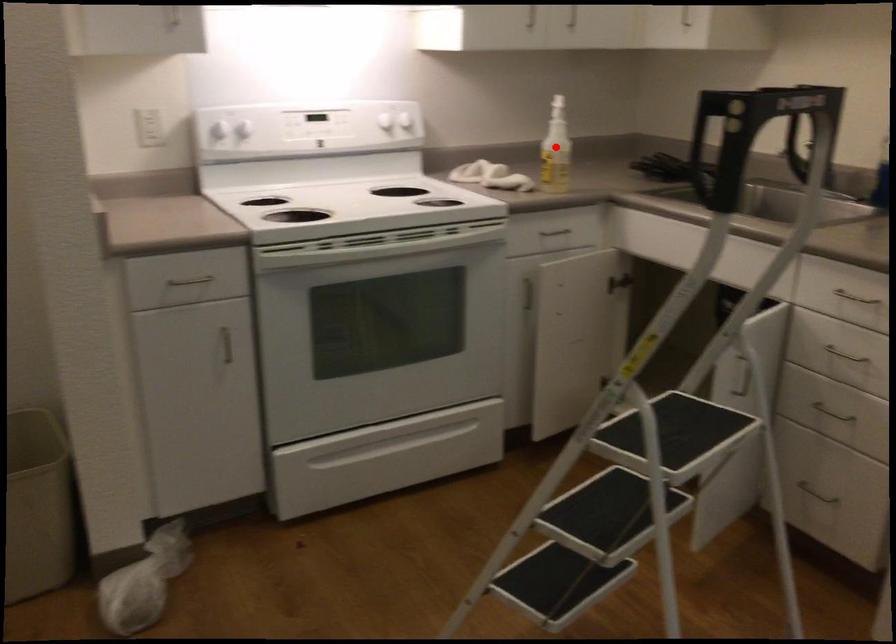
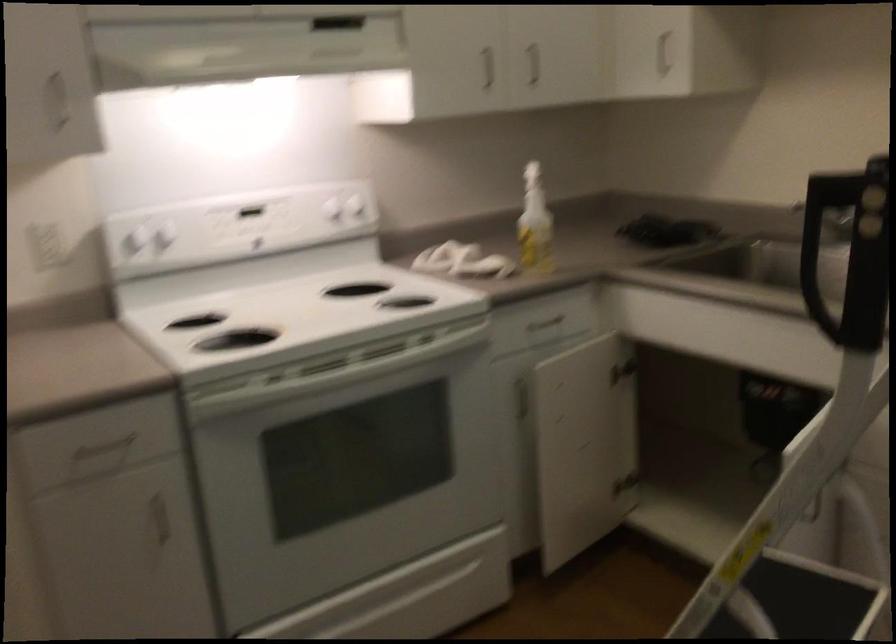
Question: I am providing you with two images of the same scene from different viewpoints. A red point is shown in image1. For the corresponding object point in image2, is it positioned nearer or farther from the camera?

Choices:
 (A) Nearer
 (B) Farther

Answer: (A)